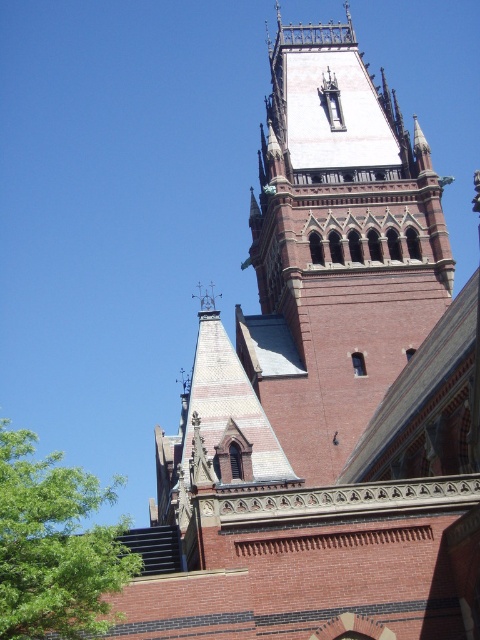
Image resolution: width=480 pixels, height=640 pixels. What do you see at coordinates (336, 248) in the screenshot?
I see `red brick bell tower at center` at bounding box center [336, 248].

Is red brick bell tower at center above green leafy tree at lower left?

Indeed, red brick bell tower at center is positioned over green leafy tree at lower left.

I want to click on red brick bell tower at center, so click(x=336, y=248).

This screenshot has width=480, height=640. Find the location of `red brick bell tower at center`. red brick bell tower at center is located at coordinates (336, 248).